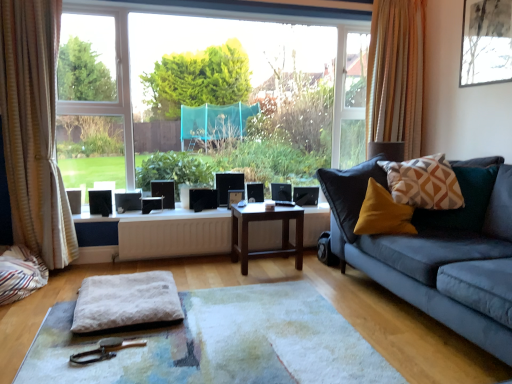
This screenshot has height=384, width=512. Find the location of `free space on the front side of brown wooden table at center`. free space on the front side of brown wooden table at center is located at coordinates (265, 281).